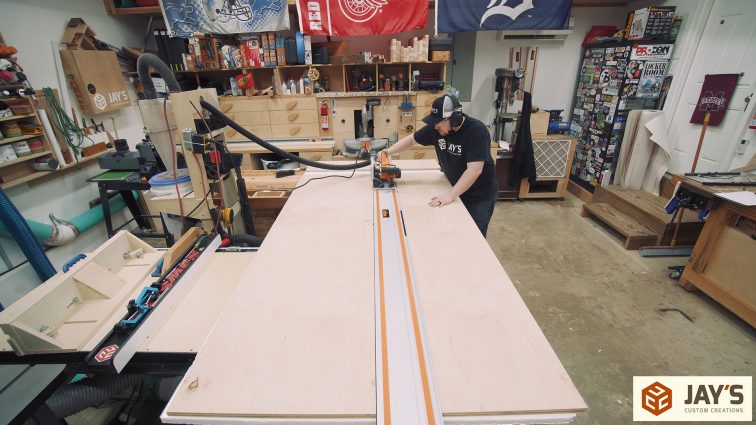
The height and width of the screenshot is (425, 756). Find the location of `white door`. white door is located at coordinates (723, 37).